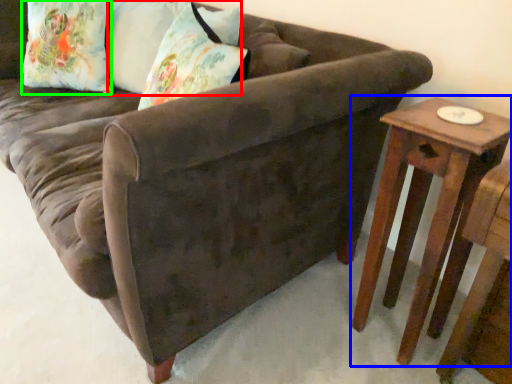
Question: Estimate the real-world distances between objects in this image. Which object is closer to pillow (highlighted by a red box), table (highlighted by a blue box) or pillow (highlighted by a green box)?

Choices:
 (A) table
 (B) pillow

Answer: (B)